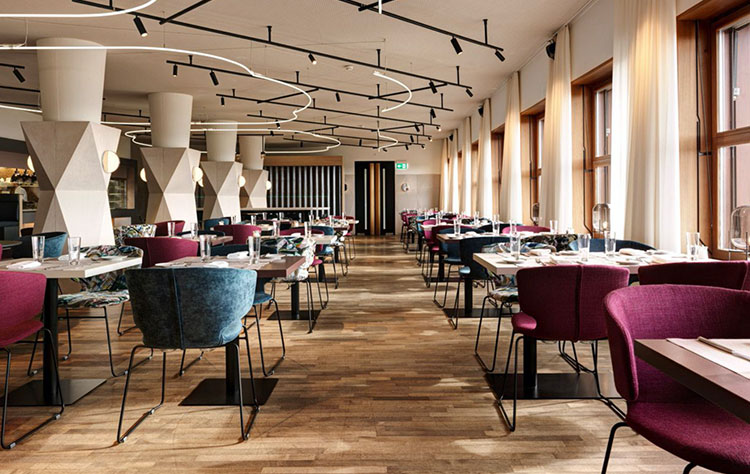
I want to click on window, so pos(445,166), pos(457,170), pos(472,170), pos(498,170), pos(534,173), pos(609,177), pos(730,173).